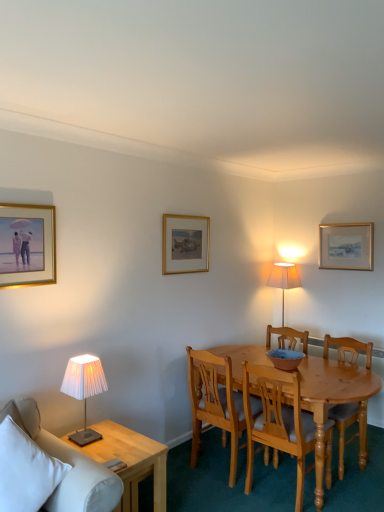
Question: Considering their positions, is matte blue bowl at center located in front of or behind light brown wooden chair at center, arranged as the first chair when viewed from the left?

Choices:
 (A) front
 (B) behind

Answer: (B)

Question: Considering the positions of matte blue bowl at center and light brown wooden chair at center, the 3th chair positioned from the right, in the image, is matte blue bowl at center taller or shorter than light brown wooden chair at center, the 3th chair positioned from the right,?

Choices:
 (A) short
 (B) tall

Answer: (A)

Question: Based on their relative distances, which object is farther from the wooden chair at center, the first chair positioned from the right?

Choices:
 (A) white pleated fabric lampshade at left
 (B) light wood side table at lower left
 (C) gold-framed painting at upper left, which ranks as the 1th picture frame in left-to-right order
 (D) white fabric couch at lower left
 (E) light brown wood chair at center, the second chair viewed from the right

Answer: (C)

Question: Based on their relative distances, which object is nearer to the light brown wooden chair at center, arranged as the first chair when viewed from the left?

Choices:
 (A) light wood side table at lower left
 (B) light brown wood chair at center, arranged as the 2th chair when viewed from the left
 (C) gold-framed picture at upper right, the first picture frame in the back-to-front sequence
 (D) gold-framed painting at upper left, the first picture frame from the front
 (E) matte blue bowl at center

Answer: (B)